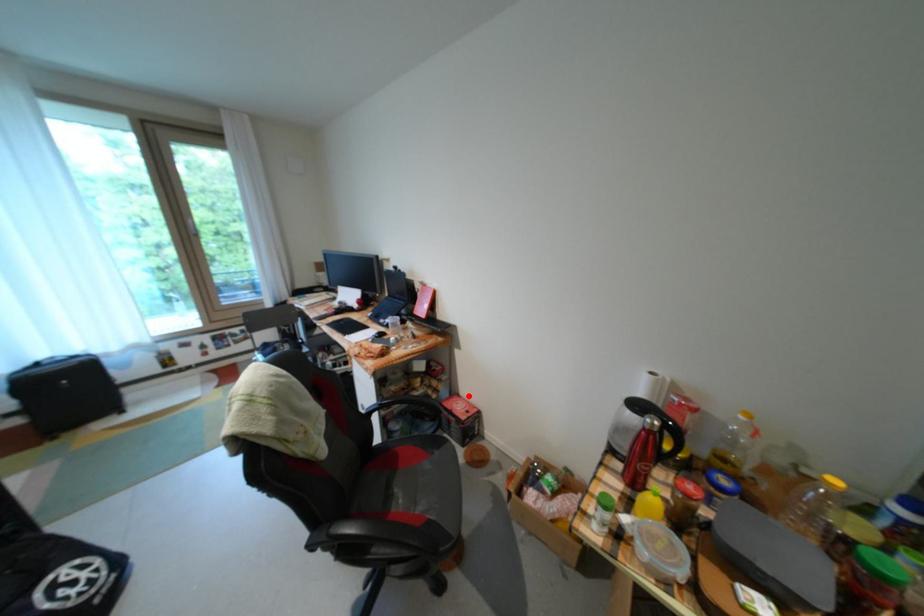
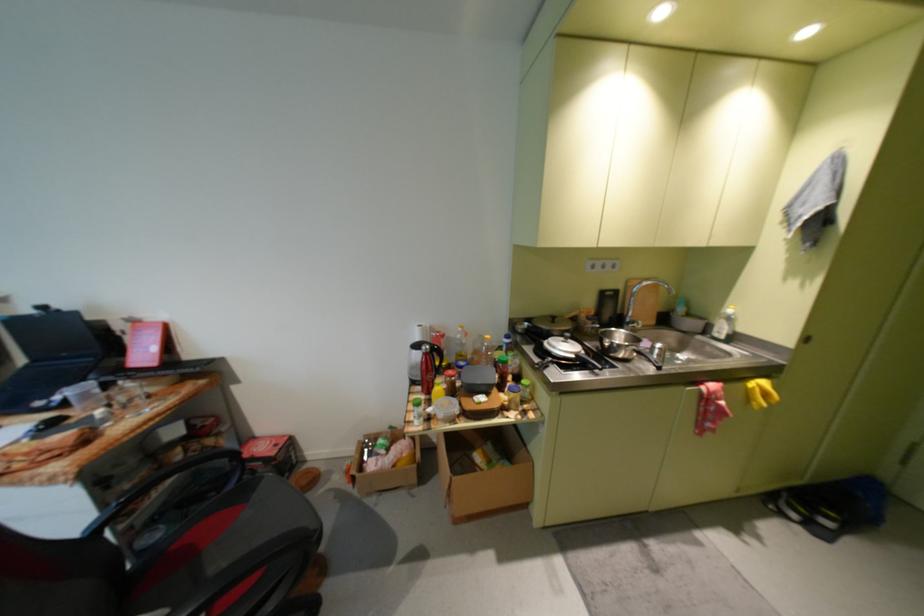
Where in the second image is the point corresponding to the highlighted location from the first image?

(264, 439)